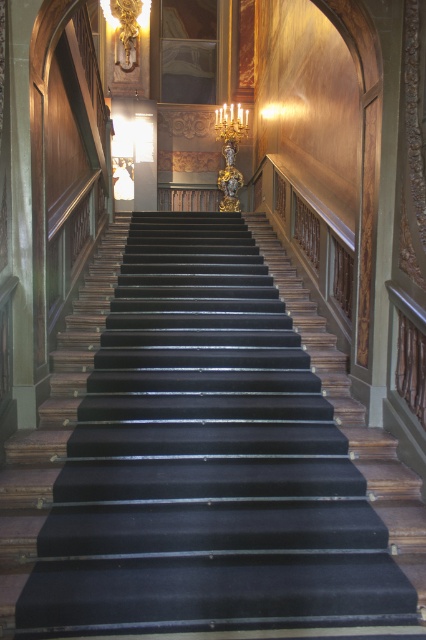
Looking at this image, which is below, black velvet stairs at center or gold metallic chandelier at upper center?

Positioned lower is black velvet stairs at center.

Does black velvet stairs at center have a lesser width compared to gold metallic chandelier at upper center?

In fact, black velvet stairs at center might be wider than gold metallic chandelier at upper center.

In the scene shown: Who is more forward, (x=48, y=561) or (x=222, y=125)?

Positioned in front is point (x=48, y=561).

Where is `black velvet stairs at center`? black velvet stairs at center is located at coordinates (193, 465).